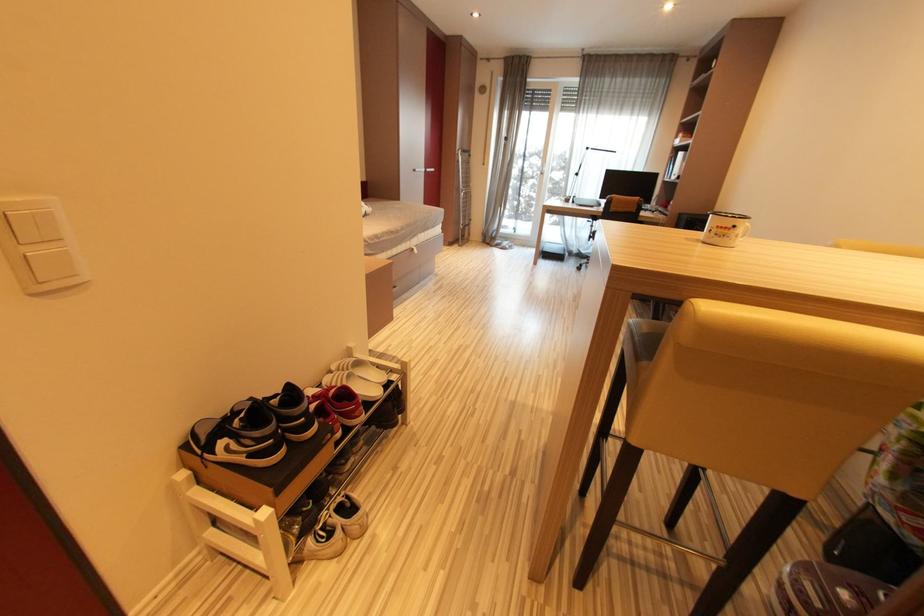
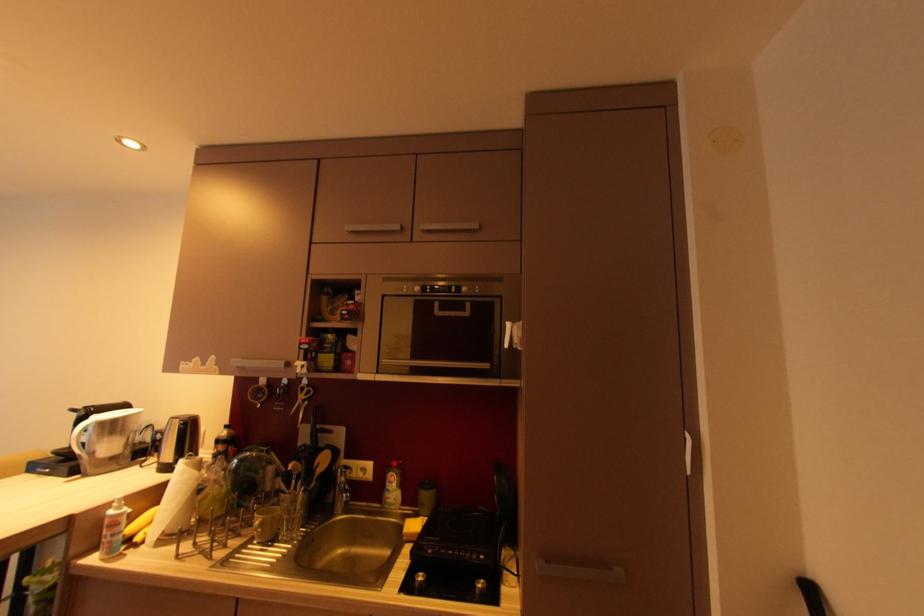
Question: The first image is from the beginning of the video and the second image is from the end. How did the camera likely rotate when shooting the video?

Choices:
 (A) Left
 (B) Right
 (C) Up
 (D) Down

Answer: (B)